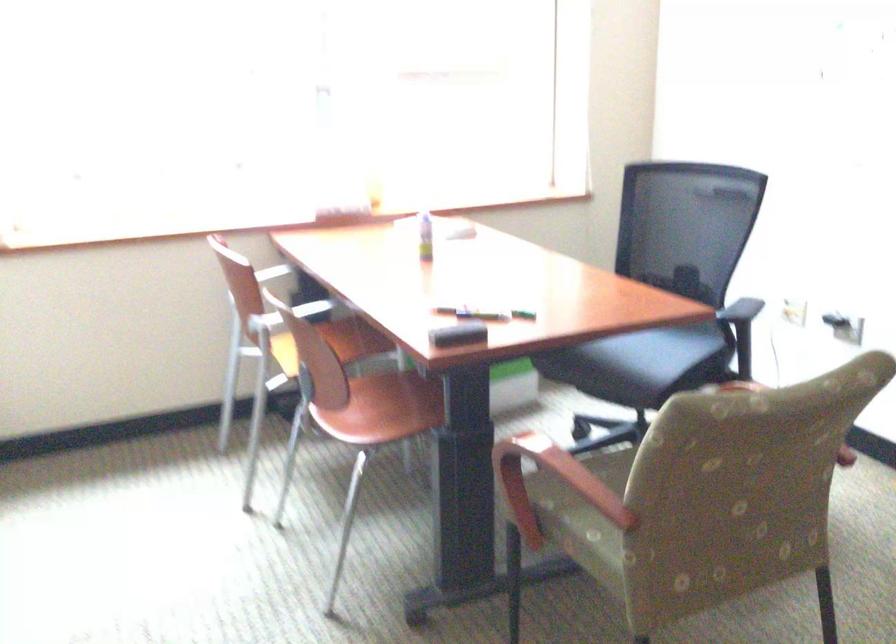
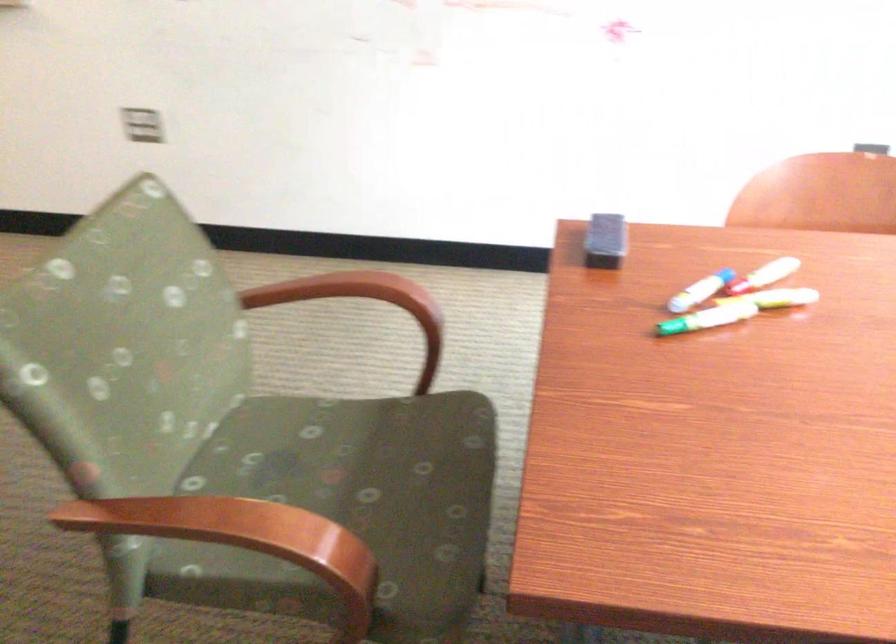
In the second image, find the point that corresponds to (x=438, y=304) in the first image.

(773, 270)